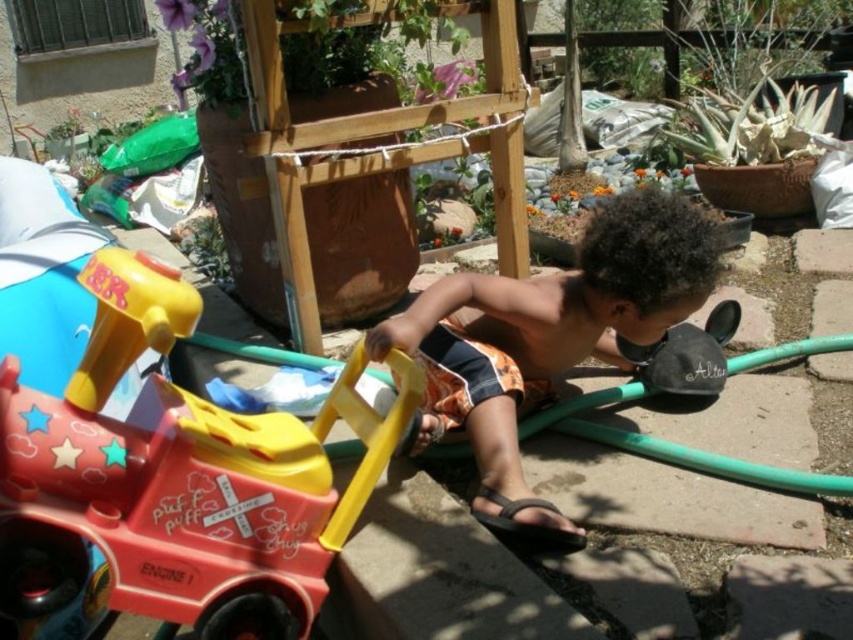
Question: Does matte plastic train at lower left lie behind brown textured shorts at center?

Choices:
 (A) no
 (B) yes

Answer: (A)

Question: Which point is closer to the camera?

Choices:
 (A) matte plastic train at lower left
 (B) brown textured shorts at center

Answer: (A)

Question: Is matte plastic train at lower left above brown textured shorts at center?

Choices:
 (A) no
 (B) yes

Answer: (A)

Question: Which object appears closest to the camera in this image?

Choices:
 (A) brown textured shorts at center
 (B) matte plastic train at lower left

Answer: (B)

Question: Which object is farther from the camera taking this photo?

Choices:
 (A) brown textured shorts at center
 (B) matte plastic train at lower left

Answer: (A)

Question: In this image, where is matte plastic train at lower left located relative to brown textured shorts at center?

Choices:
 (A) above
 (B) below

Answer: (B)